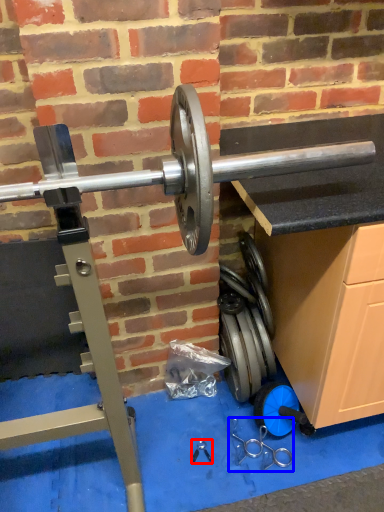
Question: Which of the following is the farthest to the observer, tool (highlighted by a red box) or tool (highlighted by a blue box)?

Choices:
 (A) tool
 (B) tool

Answer: (A)